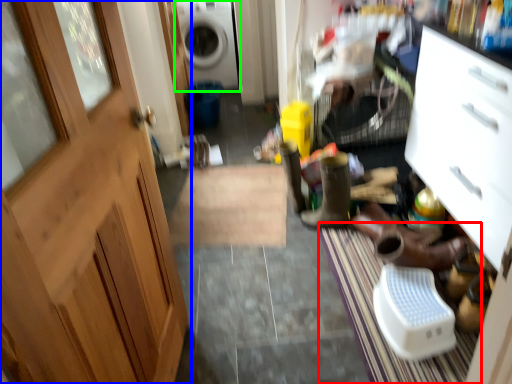
Question: Which object is the farthest from doormat (highlighted by a red box)? Choose among these: door (highlighted by a blue box) or washing machine (highlighted by a green box).

Choices:
 (A) door
 (B) washing machine

Answer: (B)